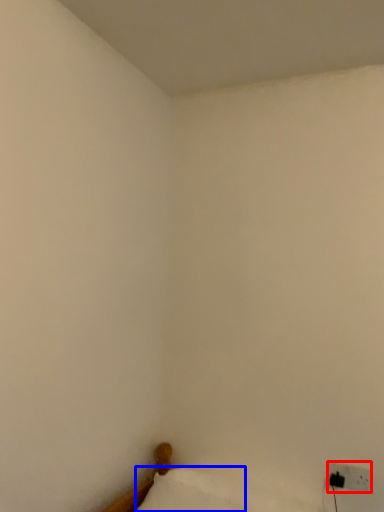
Question: Which of the following is the farthest to the observer, electric outlet (highlighted by a red box) or pillow (highlighted by a blue box)?

Choices:
 (A) electric outlet
 (B) pillow

Answer: (A)